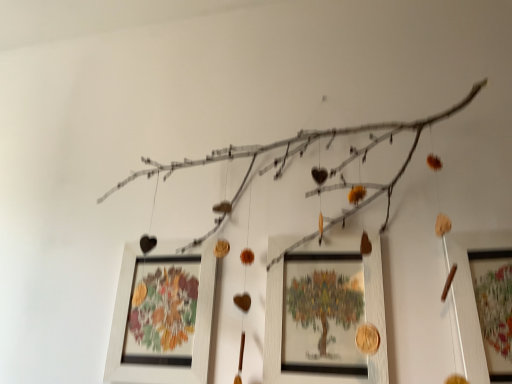
Question: Considering their positions, is wooden picture frame at right, arranged as the third picture frame when viewed from the left, located in front of or behind wooden framed picture at center, the second picture frame viewed from the right?

Choices:
 (A) front
 (B) behind

Answer: (A)

Question: Based on their positions, is wooden picture frame at right, which is counted as the 1th picture frame, starting from the right, located to the left or right of wooden framed picture at center, the second picture frame viewed from the right?

Choices:
 (A) right
 (B) left

Answer: (A)

Question: Which object is the closest to the wooden picture frame at right, which is counted as the 1th picture frame, starting from the right?

Choices:
 (A) wooden frame at center, which appears as the first picture frame when viewed from the left
 (B) wooden framed picture at center, marked as the 2th picture frame in a left-to-right arrangement

Answer: (B)

Question: Based on their relative distances, which object is farther from the wooden picture frame at right, which is counted as the 1th picture frame, starting from the right?

Choices:
 (A) wooden framed picture at center, marked as the 2th picture frame in a left-to-right arrangement
 (B) wooden frame at center, which appears as the first picture frame when viewed from the left

Answer: (B)